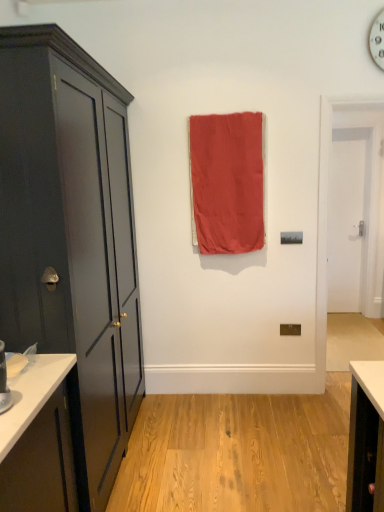
Where is `blank space situated above coral fabric curtain at center (from a real-world perspective)`? blank space situated above coral fabric curtain at center (from a real-world perspective) is located at coordinates (224, 113).